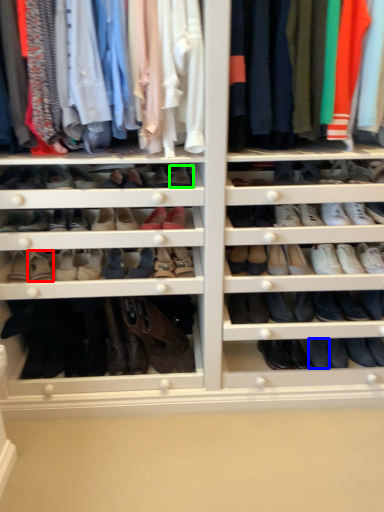
Question: Considering the real-world distances, which object is farthest from shoe (highlighted by a red box)? shoe (highlighted by a blue box) or shoe (highlighted by a green box)?

Choices:
 (A) shoe
 (B) shoe

Answer: (A)